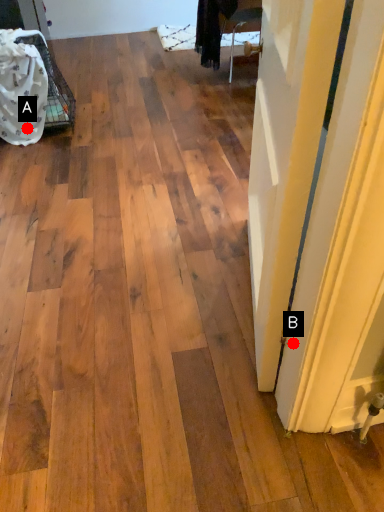
Question: Two points are circled on the image, labeled by A and B beside each circle. Which point is closer to the camera taking this photo?

Choices:
 (A) A is closer
 (B) B is closer

Answer: (B)